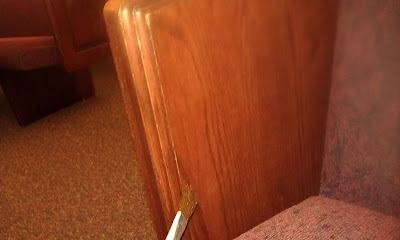
Where is `brown patterned rug`? The image size is (400, 240). brown patterned rug is located at coordinates (111, 93), (48, 203).